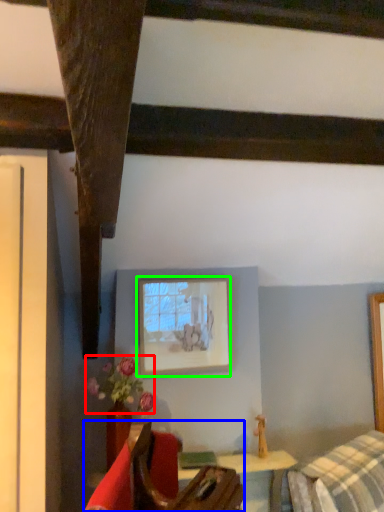
Question: Which object is the closest to the flower (highlighted by a red box)? Choose among these: furniture (highlighted by a blue box) or picture frame (highlighted by a green box).

Choices:
 (A) furniture
 (B) picture frame

Answer: (B)